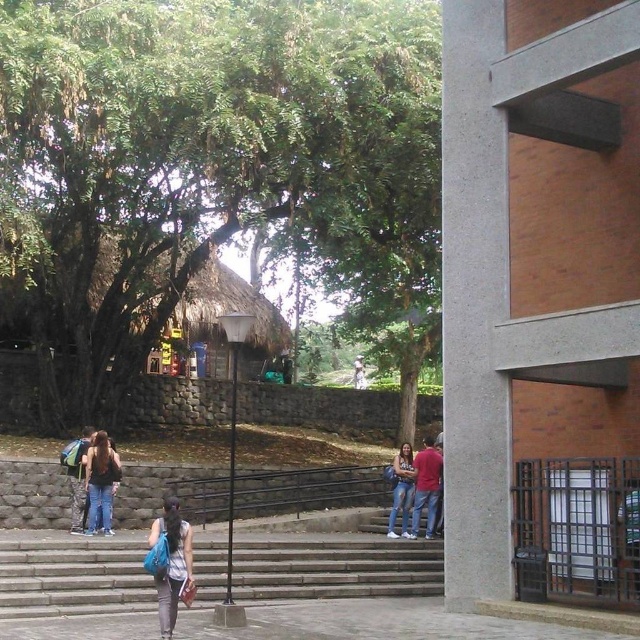
Is green leafy tree at center to the left of denim jeans at center from the viewer's perspective?

Indeed, green leafy tree at center is positioned on the left side of denim jeans at center.

Consider the image. Who is positioned more to the left, green leafy tree at center or denim jeans at center?

green leafy tree at center

This screenshot has width=640, height=640. Find the location of `green leafy tree at center`. green leafy tree at center is located at coordinates (211, 164).

Is thatched roof hut at center in front of denim jeans at center?

Yes, thatched roof hut at center is in front of denim jeans at center.

Which is in front, point (497, 580) or point (410, 445)?

Point (497, 580) is more forward.

Image resolution: width=640 pixels, height=640 pixels. Describe the element at coordinates (509, 262) in the screenshot. I see `thatched roof hut at center` at that location.

Locate an element on the screen. The width and height of the screenshot is (640, 640). thatched roof hut at center is located at coordinates (509, 262).

Can you confirm if matte blue backpack at lower left is bigger than light brown wooden statue at center?

Yes, matte blue backpack at lower left is bigger than light brown wooden statue at center.

Is point (76, 529) in front of point (358, 356)?

Yes.

Who is more forward, (70, 468) or (364, 376)?

Point (70, 468) is more forward.

The height and width of the screenshot is (640, 640). I want to click on matte blue backpack at lower left, so click(77, 476).